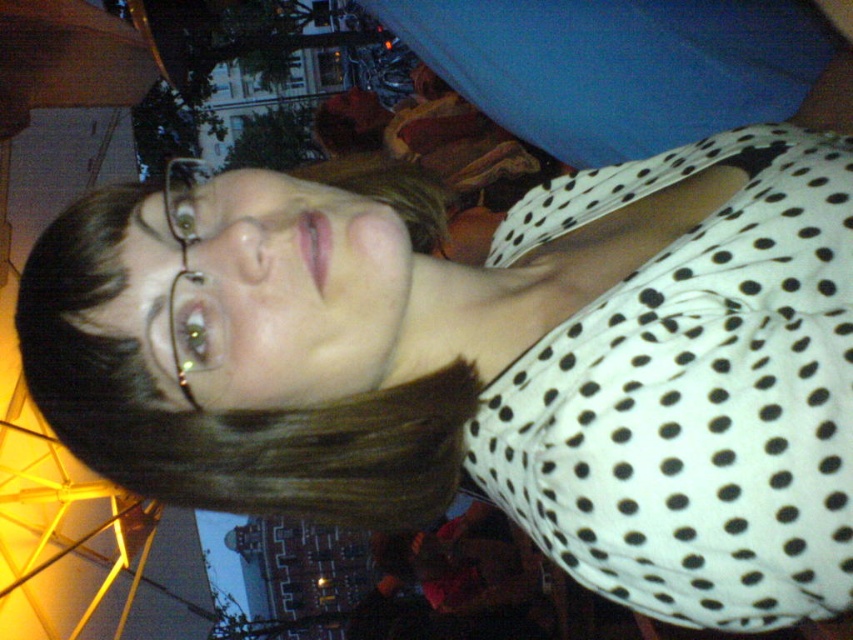
You are organizing a small event and need to decide which item to place on a shelf. The shelf can only hold items that are smaller than the other. Which item should you choose between the white dotted fabric at center and the brown smooth hair at upper left?

The brown smooth hair at upper left should be chosen because it is smaller in size than the white dotted fabric at center, making it suitable for the shelf that requires smaller items.

Looking at the scene, which object is positioned more to the left between the brown smooth hair at upper left and the clear plastic glasses at upper left?

The clear plastic glasses at upper left are positioned more to the left than the brown smooth hair at upper left.